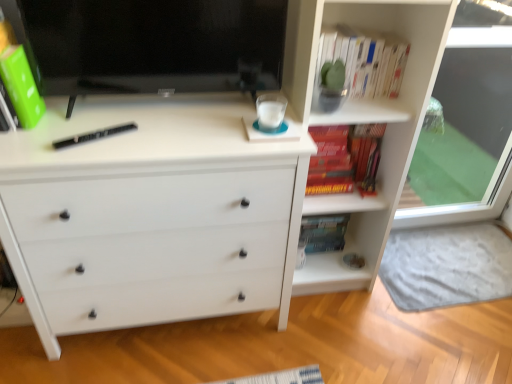
Question: Would you say matte black monitor at upper left is to the left or to the right of white matte chest of drawers at center in the picture?

Choices:
 (A) left
 (B) right

Answer: (B)

Question: In the image, is matte black monitor at upper left positioned in front of or behind white matte chest of drawers at center?

Choices:
 (A) behind
 (B) front

Answer: (A)

Question: Estimate the real-world distances between objects in this image. Which object is farther from the white matte chest of drawers at center?

Choices:
 (A) white paper book at upper right, which is the first book in top-to-bottom order
 (B) hardcover book at center-right, which is the first paperback book in right-to-left order
 (C) green matte book at upper left, marked as the first paperback book in a top-to-bottom arrangement
 (D) black hardback book at center
 (E) transparent glass door at right

Answer: (E)

Question: Which is nearer to the black hardback book at center?

Choices:
 (A) white paper book at upper right, which is the second book from bottom to top
 (B) green matte book at upper left, the second paperback book when ordered from back to front
 (C) hardcover book at center-right, which appears as the 1th paperback book when ordered from the bottom
 (D) white matte chest of drawers at center
 (E) transparent glass door at right

Answer: (B)